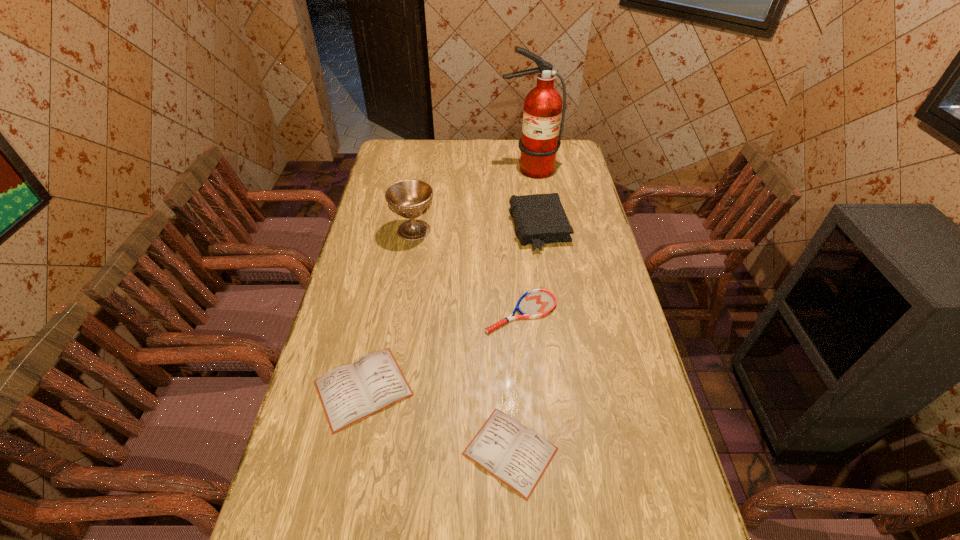
I want to click on vacant space located on the nozzle and handle of the tallest object, so click(x=531, y=186).

In order to click on free space located on the left of the fourth shortest object in this screenshot , I will do `click(464, 228)`.

Image resolution: width=960 pixels, height=540 pixels. I want to click on vacant space located on the back of the fifth shortest object, so click(420, 195).

Where is `free space located 0.180m on the right of the tennis racket`? free space located 0.180m on the right of the tennis racket is located at coordinates (613, 312).

Find the location of a particular element. This screenshot has height=540, width=960. object present at the far edge is located at coordinates (543, 104).

The image size is (960, 540). In order to click on object that is at the near edge in this screenshot , I will do `click(517, 456)`.

At what (x,y) coordinates should I click in order to perform the action: click on diary at the left edge. Please return your answer as a coordinate pair (x, y). Image resolution: width=960 pixels, height=540 pixels. Looking at the image, I should click on (349, 393).

I want to click on chalice located at the left edge, so click(x=410, y=199).

Identify the location of fire extinguisher at the right edge. The image size is (960, 540). (543, 104).

Locate an element on the screen. Bible situated at the right edge is located at coordinates (540, 219).